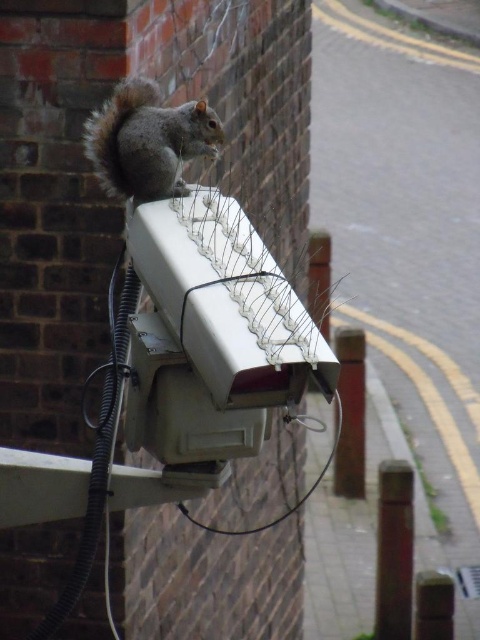
Question: Can you confirm if gray furry squirrel at upper center is positioned to the left of smooth brown pole at lower right?

Choices:
 (A) yes
 (B) no

Answer: (A)

Question: Which object is farther from the camera taking this photo?

Choices:
 (A) metallic pole at center
 (B) smooth brown pole at lower right
 (C) gray furry squirrel at upper center
 (D) metallic wire at upper center

Answer: (A)

Question: Does metallic pole at center have a lesser width compared to metallic wire at upper center?

Choices:
 (A) yes
 (B) no

Answer: (A)

Question: Which of the following is the closest to the observer?

Choices:
 (A) gray furry squirrel at upper center
 (B) metallic wire at upper center

Answer: (B)

Question: Based on their relative distances, which object is nearer to the metallic wire at upper center?

Choices:
 (A) gray furry squirrel at upper center
 (B) metallic pole at center
 (C) smooth brown pole at lower right

Answer: (B)

Question: Can you confirm if smooth brown pole at lower right is wider than metallic pole at center?

Choices:
 (A) no
 (B) yes

Answer: (A)